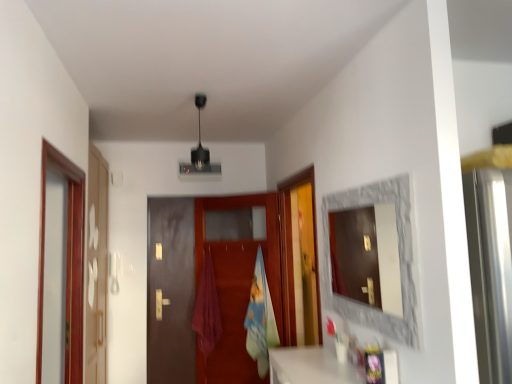
Question: From a real-world perspective, is stone textured mirror at right below blue cotton beach towel at center?

Choices:
 (A) yes
 (B) no

Answer: (B)

Question: Does stone textured mirror at right have a greater height compared to blue cotton beach towel at center?

Choices:
 (A) yes
 (B) no

Answer: (B)

Question: Does stone textured mirror at right contain blue cotton beach towel at center?

Choices:
 (A) no
 (B) yes

Answer: (A)

Question: Is stone textured mirror at right not within blue cotton beach towel at center?

Choices:
 (A) yes
 (B) no

Answer: (A)

Question: From a real-world perspective, is stone textured mirror at right located higher than blue cotton beach towel at center?

Choices:
 (A) yes
 (B) no

Answer: (A)

Question: Considering the positions of stone textured mirror at right and brown matte door at center in the image, is stone textured mirror at right bigger or smaller than brown matte door at center?

Choices:
 (A) big
 (B) small

Answer: (B)

Question: Considering the relative positions of stone textured mirror at right and brown matte door at center in the image provided, is stone textured mirror at right to the left or to the right of brown matte door at center?

Choices:
 (A) left
 (B) right

Answer: (B)

Question: Is stone textured mirror at right inside or outside of brown matte door at center?

Choices:
 (A) inside
 (B) outside

Answer: (B)

Question: From the image's perspective, relative to brown matte door at center, is stone textured mirror at right above or below?

Choices:
 (A) above
 (B) below

Answer: (A)

Question: From the image's perspective, is blue cotton beach towel at center positioned above or below brown wooden screen door at left, the 2th screen door in the back-to-front sequence?

Choices:
 (A) below
 (B) above

Answer: (A)

Question: Is point (252, 337) positioned closer to the camera than point (60, 157)?

Choices:
 (A) farther
 (B) closer

Answer: (A)

Question: Is blue cotton beach towel at center bigger or smaller than brown wooden screen door at left, which is the first screen door in front-to-back order?

Choices:
 (A) big
 (B) small

Answer: (B)

Question: From a real-world perspective, relative to brown wooden screen door at left, which is the first screen door in front-to-back order, is blue cotton beach towel at center vertically above or below?

Choices:
 (A) above
 (B) below

Answer: (B)

Question: In the image, is white glossy screen door at left, acting as the first screen door starting from the back, positioned in front of or behind brown wooden screen door at left, which is the first screen door in front-to-back order?

Choices:
 (A) behind
 (B) front

Answer: (A)

Question: Considering the relative positions of white glossy screen door at left, the 2th screen door when ordered from front to back, and brown wooden screen door at left, which is the first screen door in front-to-back order, in the image provided, is white glossy screen door at left, the 2th screen door when ordered from front to back, to the left or to the right of brown wooden screen door at left, which is the first screen door in front-to-back order,?

Choices:
 (A) right
 (B) left

Answer: (B)